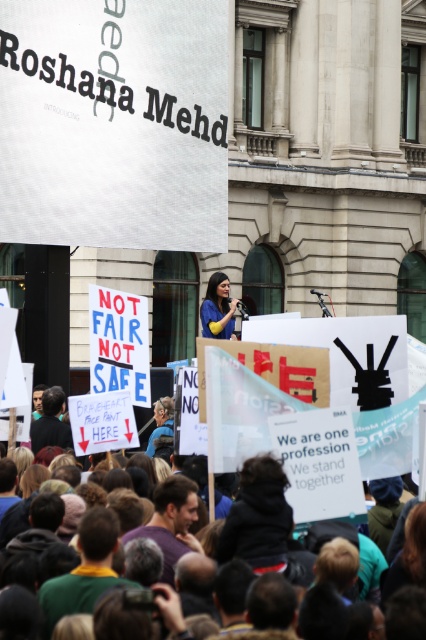
Who is more forward, (363,449) or (212,292)?

Positioned in front is point (363,449).

Is multicolored fabric crowd at center thinner than matte blue shirt at center?

No.

Based on the photo, measure the distance between multicolored fabric crowd at center and camera.

The distance of multicolored fabric crowd at center from camera is 29.75 meters.

The width and height of the screenshot is (426, 640). What are the coordinates of `multicolored fabric crowd at center` in the screenshot? It's located at (305, 440).